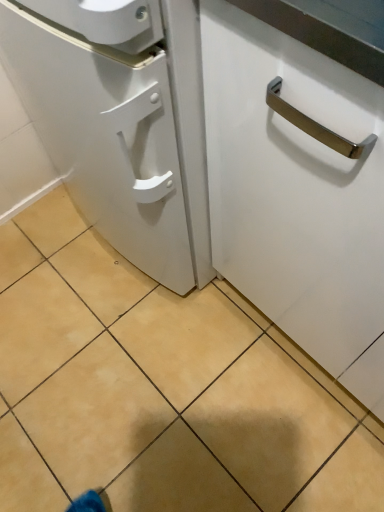
Question: Is point (382, 375) positioned closer to the camera than point (23, 328)?

Choices:
 (A) closer
 (B) farther

Answer: (A)

Question: Looking at their shapes, would you say white glossy cabinet handle at center is wider or thinner than beige tile at center?

Choices:
 (A) thin
 (B) wide

Answer: (A)

Question: In terms of height, does white glossy cabinet handle at center look taller or shorter compared to beige tile at center?

Choices:
 (A) tall
 (B) short

Answer: (A)

Question: Visually, is beige tile at center positioned to the left or to the right of white glossy cabinet handle at center?

Choices:
 (A) left
 (B) right

Answer: (A)

Question: From the image's perspective, is beige tile at center positioned above or below white glossy cabinet handle at center?

Choices:
 (A) below
 (B) above

Answer: (A)

Question: From a real-world perspective, is beige tile at center positioned above or below white glossy cabinet handle at center?

Choices:
 (A) above
 (B) below

Answer: (B)

Question: From their relative heights in the image, would you say beige tile at center is taller or shorter than white glossy cabinet handle at center?

Choices:
 (A) tall
 (B) short

Answer: (B)